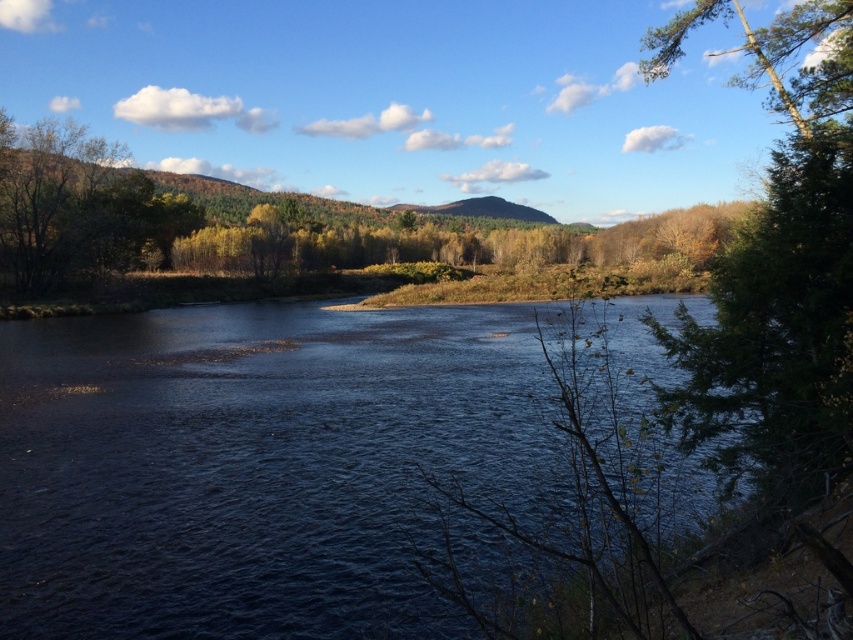
Is dark blue water at center to the left of green textured tree at right from the viewer's perspective?

Yes, dark blue water at center is to the left of green textured tree at right.

Does dark blue water at center have a lesser width compared to green textured tree at right?

No, dark blue water at center is not thinner than green textured tree at right.

Is point (260, 480) closer to camera compared to point (842, 74)?

No, it is not.

Locate an element on the screen. This screenshot has height=640, width=853. dark blue water at center is located at coordinates (254, 465).